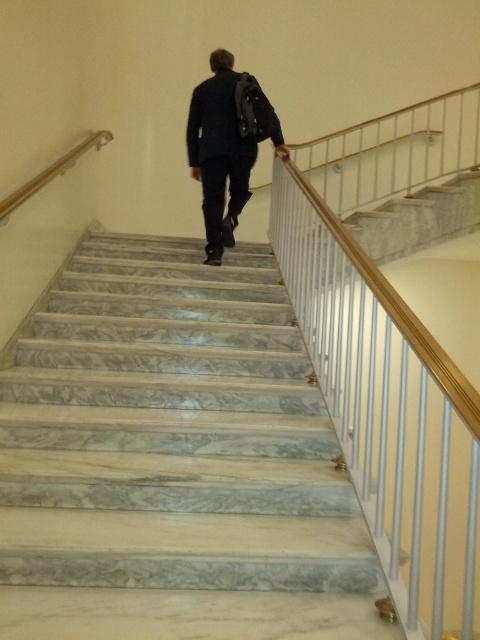
Question: Does dark blue suit at center lie behind wooden handrail at upper left?

Choices:
 (A) yes
 (B) no

Answer: (A)

Question: Is marble stairs at center thinner than wooden handrail at upper left?

Choices:
 (A) yes
 (B) no

Answer: (B)

Question: Which point is farther to the camera?

Choices:
 (A) (236, 179)
 (B) (48, 420)

Answer: (A)

Question: Considering the real-world distances, which object is farthest from the dark blue suit at center?

Choices:
 (A) marble stairs at center
 (B) wooden handrail at upper left

Answer: (A)

Question: Is marble stairs at center further to camera compared to wooden handrail at upper left?

Choices:
 (A) no
 (B) yes

Answer: (A)

Question: Based on their relative distances, which object is farther from the wooden handrail at upper left?

Choices:
 (A) marble stairs at center
 (B) dark blue suit at center

Answer: (A)